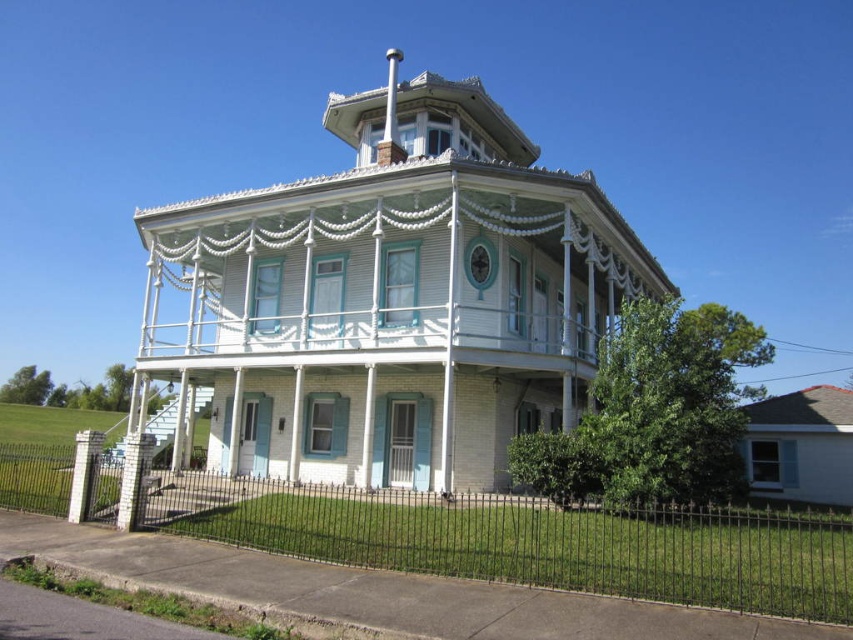
The width and height of the screenshot is (853, 640). What do you see at coordinates (532, 540) in the screenshot? I see `black wrought iron fence at lower center` at bounding box center [532, 540].

Locate an element on the screen. This screenshot has height=640, width=853. black wrought iron fence at lower center is located at coordinates (532, 540).